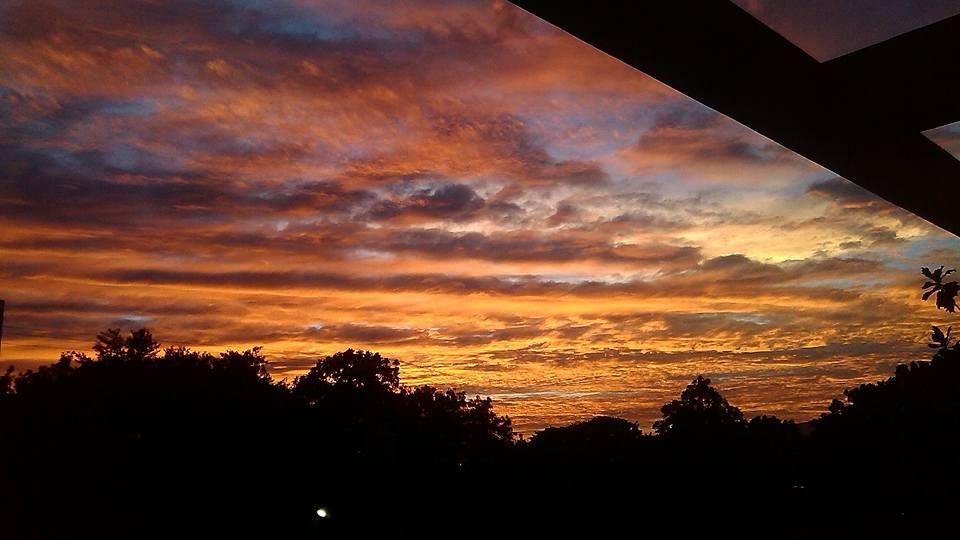
The image size is (960, 540). In order to click on rod in this screenshot , I will do `click(817, 105)`.